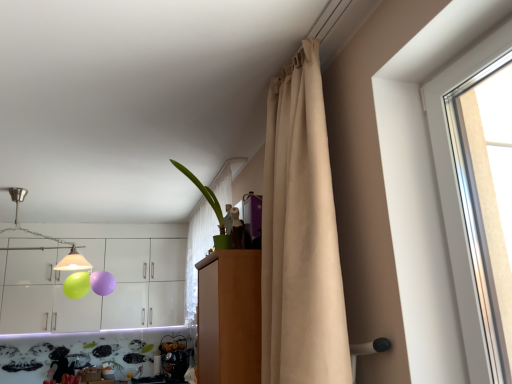
In order to click on vacant area on top of beige fabric curtain at upper right (from a real-world perspective) in this screenshot , I will do `click(262, 55)`.